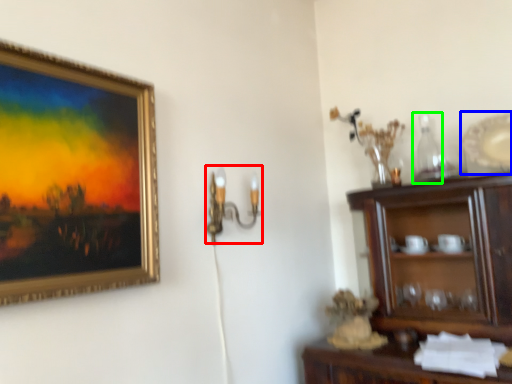
Question: Which object is the closest to the candle holder (highlighted by a red box)? Choose among these: platter (highlighted by a blue box) or bottle (highlighted by a green box).

Choices:
 (A) platter
 (B) bottle

Answer: (B)